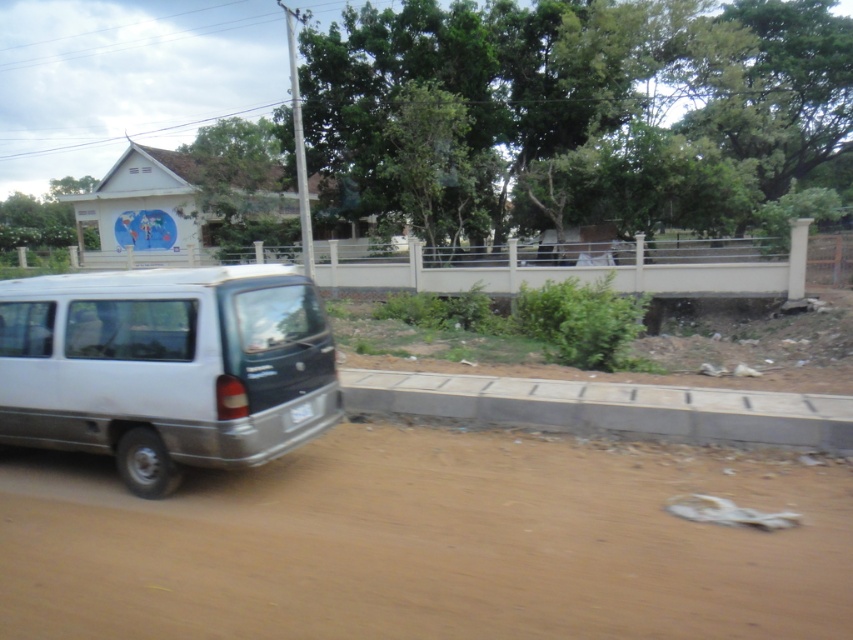
Question: Is brown dirt track at lower left thinner than gray concrete curb at lower center?

Choices:
 (A) no
 (B) yes

Answer: (A)

Question: Which point is farther to the camera?

Choices:
 (A) (x=62, y=522)
 (B) (x=125, y=288)

Answer: (B)

Question: Observing the image, what is the correct spatial positioning of white matte minivan at lower left in reference to gray concrete curb at lower center?

Choices:
 (A) right
 (B) left

Answer: (B)

Question: Estimate the real-world distances between objects in this image. Which object is farther from the gray concrete curb at lower center?

Choices:
 (A) brown dirt track at lower left
 (B) white matte minivan at lower left

Answer: (B)

Question: Does white matte minivan at lower left have a smaller size compared to gray concrete curb at lower center?

Choices:
 (A) yes
 (B) no

Answer: (A)

Question: Which of the following is the farthest from the observer?

Choices:
 (A) [x=289, y=477]
 (B) [x=252, y=296]
 (C) [x=532, y=420]

Answer: (C)